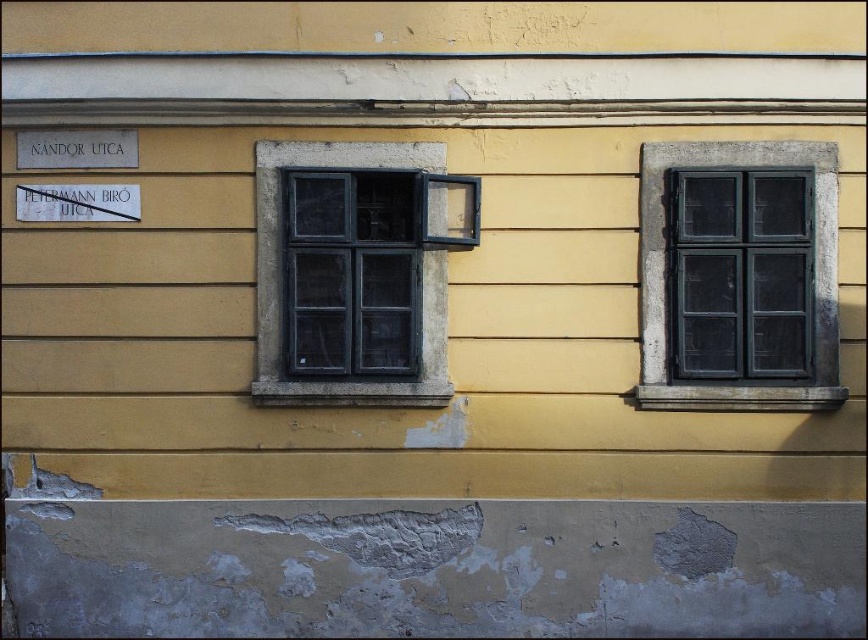
You are standing in front of the building and want to touch the matte black window at upper right and the matte black window at center. Which one can you reach without moving your position?

The matte black window at upper right is closer to you, so you can reach it without moving, but the matte black window at center is further away and may require moving closer.

You are an architect designing a new building and want to ensure proper spacing between the matte black window at upper right and the matte black window at center. Given their sizes, which window requires more horizontal space to maintain aesthetic balance?

The matte black window at upper right requires more horizontal space to maintain aesthetic balance because its width is larger than the matte black window at center.

You are a painter assessing the exterior wall. You need to paint both the matte black window at upper right and the matte black window at center. Which window requires less paint for its frame?

The matte black window at upper right requires less paint for its frame because it is smaller than the matte black window at center.